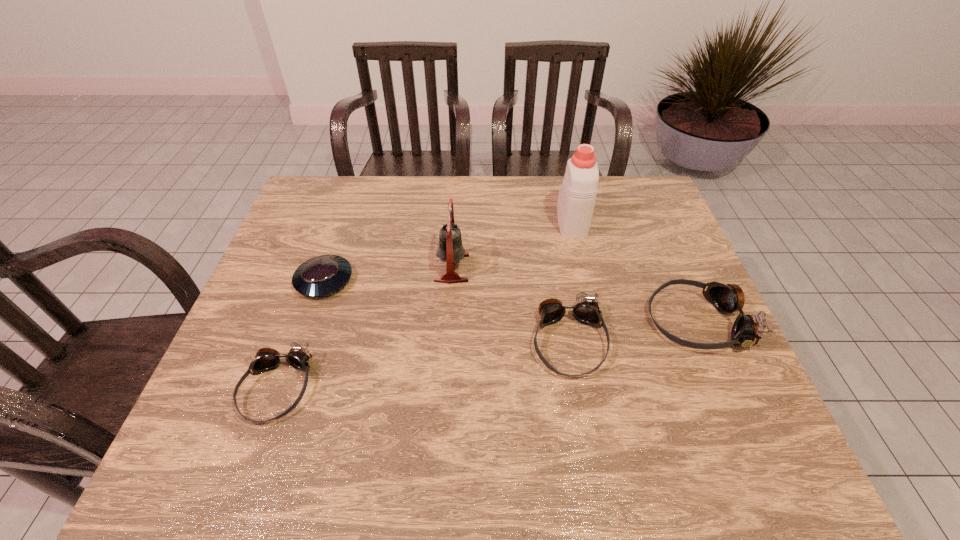
You are a GUI agent. You are given a task and a screenshot of the screen. Output one action in this format:
    pyautogui.click(x=<x>, y=<y>)
    Task: Click on the object situated at the near edge
    
    Given the screenshot: What is the action you would take?
    pyautogui.click(x=266, y=359)

Locate an element on the screen. The image size is (960, 540). goggles present at the left edge is located at coordinates (266, 359).

What are the coordinates of `saucer present at the left edge` in the screenshot? It's located at (323, 275).

Where is `object that is at the right edge`? This screenshot has width=960, height=540. object that is at the right edge is located at coordinates (747, 330).

Find the location of a particular element. object at the near left corner is located at coordinates (266, 359).

I want to click on vacant space at the far edge of the desktop, so click(x=434, y=196).

You are a GUI agent. You are given a task and a screenshot of the screen. Output one action in this format:
    pyautogui.click(x=<x>, y=<y>)
    Task: Click on the vacant space at the near edge of the desktop
    The image size is (960, 540).
    Given the screenshot: What is the action you would take?
    (508, 409)

Where is `vacant point at the right edge`? The width and height of the screenshot is (960, 540). vacant point at the right edge is located at coordinates (678, 249).

Where is `free space at the far left corner of the desktop`? This screenshot has height=540, width=960. free space at the far left corner of the desktop is located at coordinates (346, 193).

I want to click on vacant space at the near right corner of the desktop, so point(731,407).